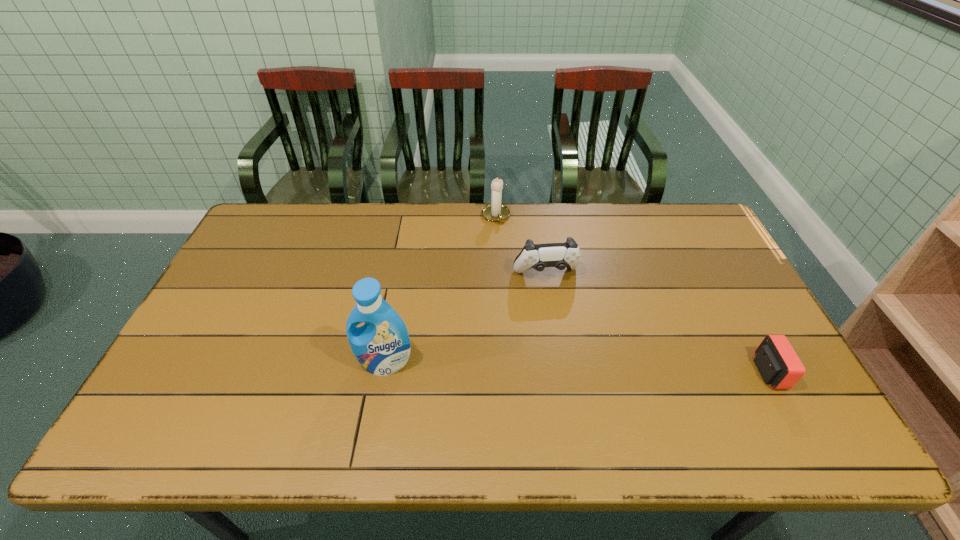
This screenshot has width=960, height=540. Find the location of `free space at the near edge of the desktop`. free space at the near edge of the desktop is located at coordinates (712, 407).

In the image, there is a desktop. At what (x,y) coordinates should I click in order to perform the action: click on vacant region at the left edge. Please return your answer as a coordinate pair (x, y). The height and width of the screenshot is (540, 960). Looking at the image, I should click on (236, 277).

The width and height of the screenshot is (960, 540). In the image, there is a desktop. In order to click on blank space at the right edge in this screenshot , I will do `click(734, 281)`.

I want to click on vacant space at the far right corner of the desktop, so click(711, 245).

Where is `free space between the second farthest object and the farthest object`? This screenshot has width=960, height=540. free space between the second farthest object and the farthest object is located at coordinates (520, 245).

Locate an element on the screen. The height and width of the screenshot is (540, 960). empty space between the third tallest object and the farthest object is located at coordinates (520, 245).

What are the coordinates of `empty location between the control and the leftmost object` in the screenshot? It's located at (466, 319).

The height and width of the screenshot is (540, 960). Find the location of `unoccupied area between the tallest object and the farthest object`. unoccupied area between the tallest object and the farthest object is located at coordinates (441, 289).

The image size is (960, 540). I want to click on free area in between the leftmost object and the control, so tap(466, 319).

Where is `blank region between the farthest object and the alarm clock`? The image size is (960, 540). blank region between the farthest object and the alarm clock is located at coordinates (632, 294).